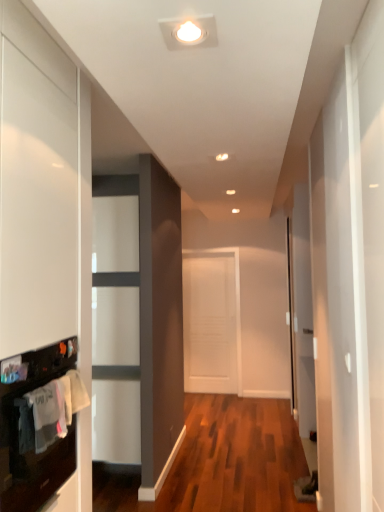
Question: Is black glossy oven at lower left closer to the viewer compared to white matte door at center?

Choices:
 (A) yes
 (B) no

Answer: (A)

Question: Can you confirm if black glossy oven at lower left is taller than white matte door at center?

Choices:
 (A) yes
 (B) no

Answer: (B)

Question: Considering the relative sizes of black glossy oven at lower left and white matte door at center in the image provided, is black glossy oven at lower left thinner than white matte door at center?

Choices:
 (A) yes
 (B) no

Answer: (B)

Question: Are black glossy oven at lower left and white matte door at center located far from each other?

Choices:
 (A) no
 (B) yes

Answer: (B)

Question: Is black glossy oven at lower left turned away from white matte door at center?

Choices:
 (A) yes
 (B) no

Answer: (B)

Question: Is white matte door at center in front of or behind black glossy oven at lower left in the image?

Choices:
 (A) behind
 (B) front

Answer: (A)

Question: Is white matte door at center wider or thinner than black glossy oven at lower left?

Choices:
 (A) thin
 (B) wide

Answer: (A)

Question: Considering the positions of point (195, 303) and point (3, 395), is point (195, 303) closer or farther from the camera than point (3, 395)?

Choices:
 (A) closer
 (B) farther

Answer: (B)

Question: Is white matte door at center bigger or smaller than black glossy oven at lower left?

Choices:
 (A) big
 (B) small

Answer: (B)

Question: From the image's perspective, is black glossy oven at lower left above or below white matte door at center?

Choices:
 (A) below
 (B) above

Answer: (B)

Question: From their relative heights in the image, would you say black glossy oven at lower left is taller or shorter than white matte door at center?

Choices:
 (A) short
 (B) tall

Answer: (A)

Question: From a real-world perspective, is black glossy oven at lower left physically located above or below white matte door at center?

Choices:
 (A) below
 (B) above

Answer: (B)

Question: Do you think black glossy oven at lower left is within white matte door at center, or outside of it?

Choices:
 (A) inside
 (B) outside

Answer: (B)

Question: Is white cotton laundry at left wider or thinner than black glossy oven at lower left?

Choices:
 (A) wide
 (B) thin

Answer: (B)

Question: From the image's perspective, is white cotton laundry at left located above or below black glossy oven at lower left?

Choices:
 (A) above
 (B) below

Answer: (A)